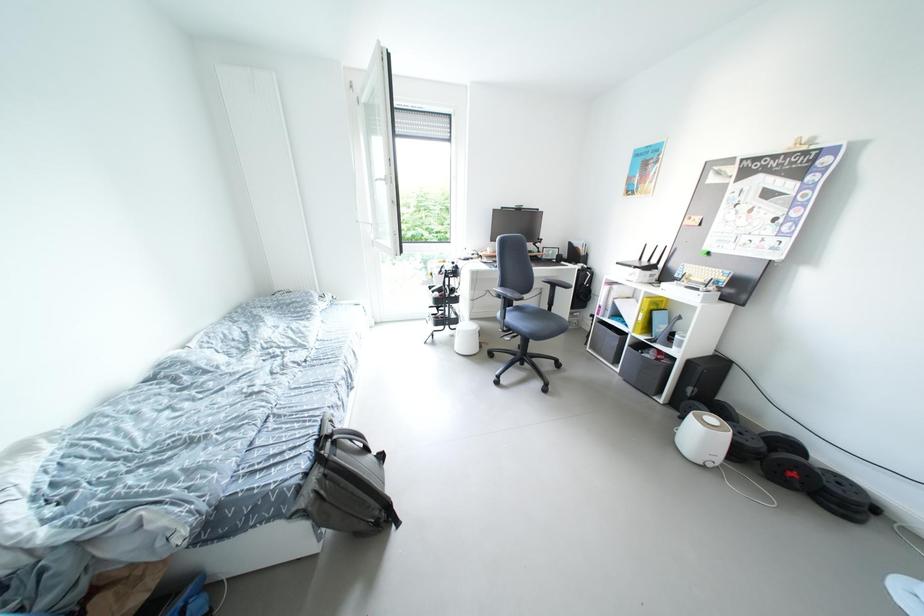
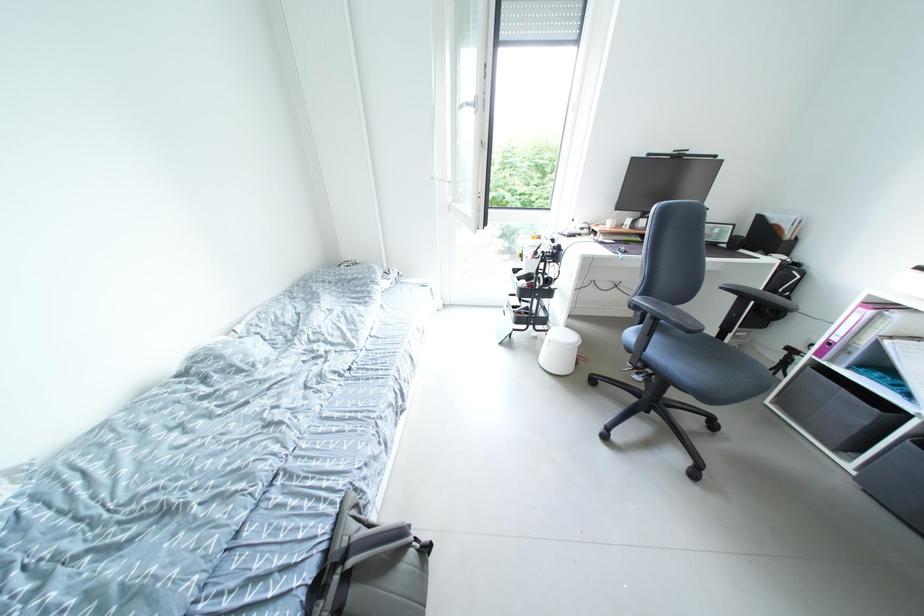
Question: The images are taken continuously from a first-person perspective. In which direction are you moving?

Choices:
 (A) Left
 (B) Right
 (C) Forward
 (D) Backward

Answer: (C)